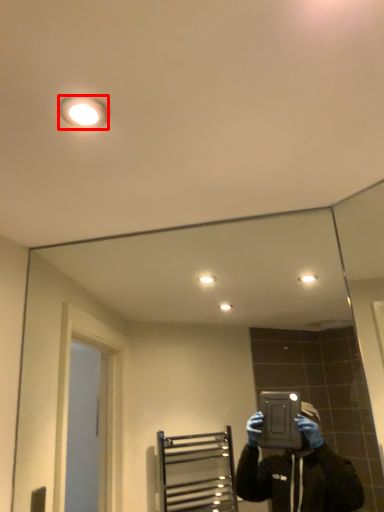
Question: From the image's perspective, where is light fixture (annotated by the red box) located relative to mirror?

Choices:
 (A) above
 (B) below

Answer: (A)